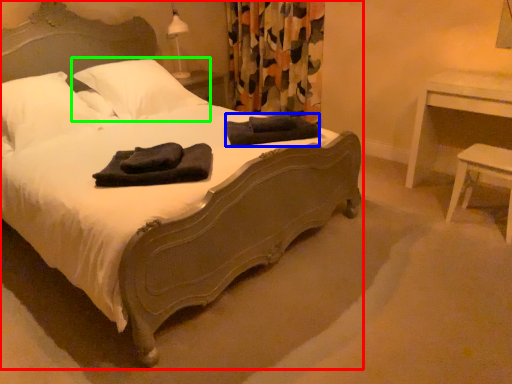
Question: Which object is the closest to the bed (highlighted by a red box)? Choose among these: material (highlighted by a blue box) or pillow (highlighted by a green box).

Choices:
 (A) material
 (B) pillow

Answer: (A)